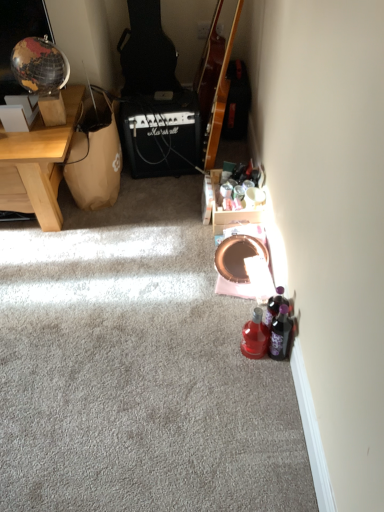
Question: Is wooden desk at left smaller than white cardboard box at upper left?

Choices:
 (A) no
 (B) yes

Answer: (A)

Question: From a real-world perspective, does wooden desk at left sit lower than white cardboard box at upper left?

Choices:
 (A) no
 (B) yes

Answer: (B)

Question: Does wooden desk at left have a larger size compared to white cardboard box at upper left?

Choices:
 (A) no
 (B) yes

Answer: (B)

Question: Does wooden desk at left lie behind white cardboard box at upper left?

Choices:
 (A) yes
 (B) no

Answer: (B)

Question: From the image's perspective, would you say wooden desk at left is shown under white cardboard box at upper left?

Choices:
 (A) no
 (B) yes

Answer: (B)

Question: Does wooden desk at left appear on the right side of white cardboard box at upper left?

Choices:
 (A) no
 (B) yes

Answer: (A)

Question: Does glossy wood guitar at upper center have a larger size compared to white cardboard box at upper left?

Choices:
 (A) yes
 (B) no

Answer: (A)

Question: From the image's perspective, would you say glossy wood guitar at upper center is shown under white cardboard box at upper left?

Choices:
 (A) yes
 (B) no

Answer: (B)

Question: Does glossy wood guitar at upper center come behind white cardboard box at upper left?

Choices:
 (A) no
 (B) yes

Answer: (B)

Question: Does glossy wood guitar at upper center appear on the left side of white cardboard box at upper left?

Choices:
 (A) yes
 (B) no

Answer: (B)

Question: Considering the relative sizes of glossy wood guitar at upper center and white cardboard box at upper left in the image provided, is glossy wood guitar at upper center thinner than white cardboard box at upper left?

Choices:
 (A) yes
 (B) no

Answer: (B)

Question: Is glossy wood guitar at upper center to the right of white cardboard box at upper left from the viewer's perspective?

Choices:
 (A) yes
 (B) no

Answer: (A)

Question: From the image's perspective, is translucent purple bottle at lower right, which is the 2th bottle in right-to-left order, beneath black matte marshall amplifier at center?

Choices:
 (A) yes
 (B) no

Answer: (A)